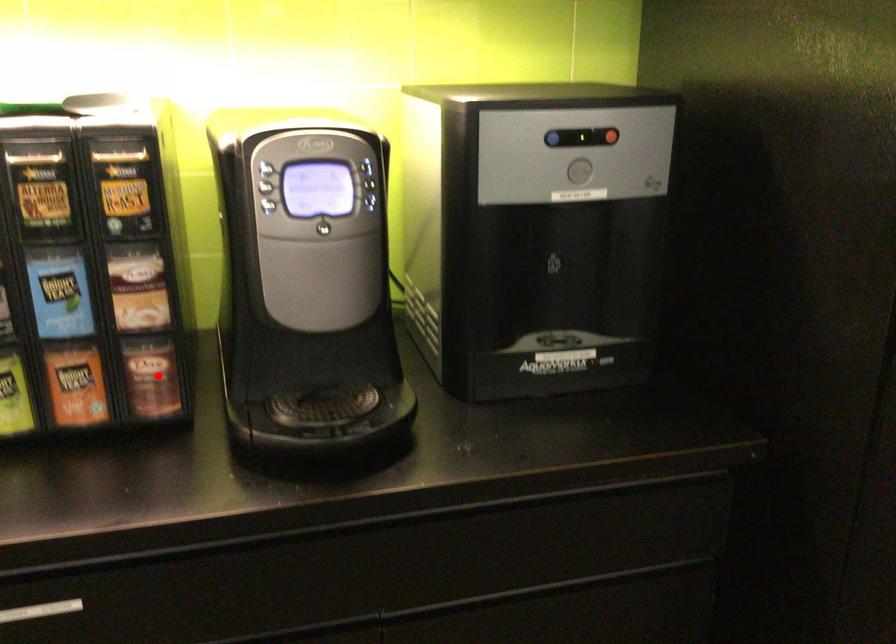
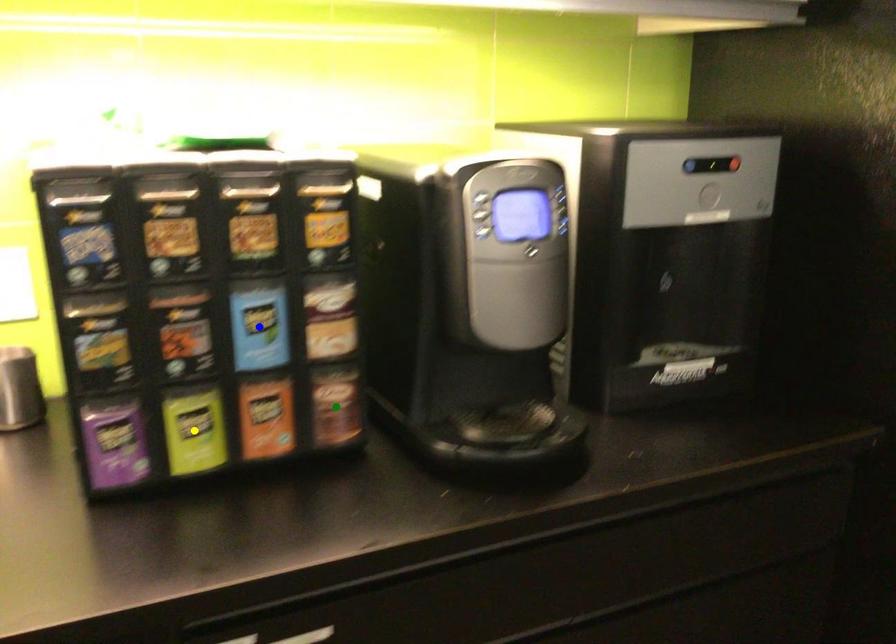
Question: I am providing you with two images of the same scene from different viewpoints. A red point is marked on the first image. You are given multiple points on the second image. Which point in image 2 represents the same 3d spot as the red point in image 1?

Choices:
 (A) blue point
 (B) yellow point
 (C) green point

Answer: (C)